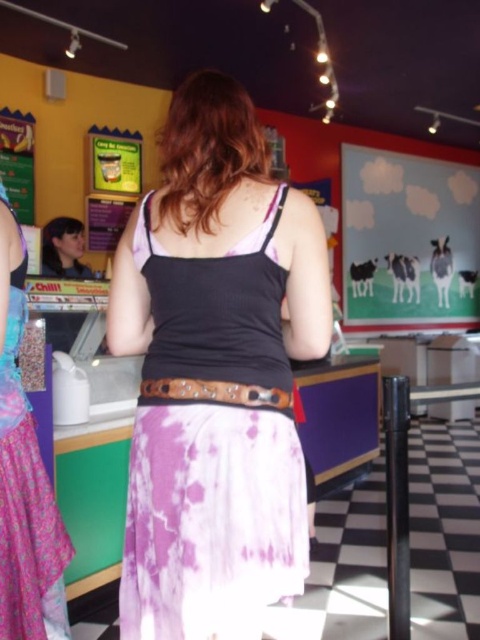
Question: Among these objects, which one is nearest to the camera?

Choices:
 (A) brown leather belt at center
 (B) pastel paperboard at upper right
 (C) matte black hair at left

Answer: (A)

Question: Which of the following is the farthest from the observer?

Choices:
 (A) (456, 301)
 (B) (240, 145)
 (C) (173, 385)
 (D) (61, 220)

Answer: (A)

Question: Which of the following is the farthest from the observer?

Choices:
 (A) (36, 532)
 (B) (182, 388)

Answer: (A)

Question: Can you confirm if purple tie-dye skirt at center is positioned to the right of pastel paperboard at upper right?

Choices:
 (A) no
 (B) yes

Answer: (A)

Question: Is purple tie-dye skirt at center above matte black hair at left?

Choices:
 (A) no
 (B) yes

Answer: (A)

Question: Is purple tie-dye skirt at center bigger than brown leather belt at center?

Choices:
 (A) yes
 (B) no

Answer: (A)